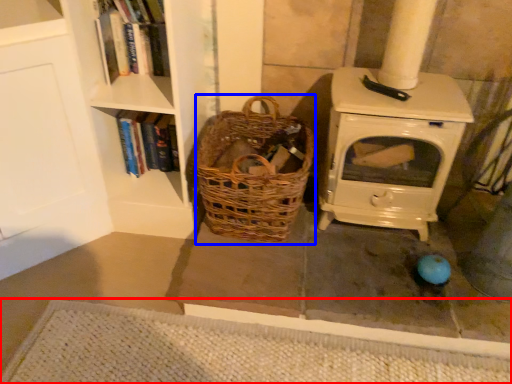
Question: Which object is closer to the camera taking this photo, doormat (highlighted by a red box) or basket (highlighted by a blue box)?

Choices:
 (A) doormat
 (B) basket

Answer: (A)